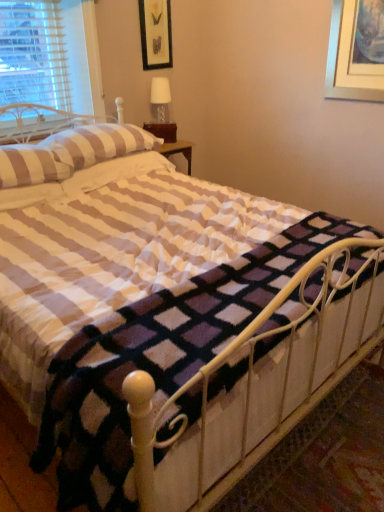
Question: Do you think striped fabric pillow at upper left, the 3th pillow in the back-to-front sequence, is within black matte picture frame at upper center, or outside of it?

Choices:
 (A) inside
 (B) outside

Answer: (B)

Question: In terms of height, does striped fabric pillow at upper left, the 3th pillow in the back-to-front sequence, look taller or shorter compared to black matte picture frame at upper center?

Choices:
 (A) short
 (B) tall

Answer: (A)

Question: Based on their relative distances, which object is nearer to the black matte picture frame at upper center?

Choices:
 (A) striped fabric pillow at upper left, marked as the 2th pillow in a front-to-back arrangement
 (B) white matte table lamp at upper center
 (C) striped fabric pillow at upper left, the 3th pillow in the back-to-front sequence
 (D) striped fabric pillow at upper left, which appears as the first pillow when viewed from the back
 (E) white metal bed frame at center

Answer: (B)

Question: Considering the real-world distances, which object is farthest from the striped fabric pillow at upper left, marked as the 2th pillow in a front-to-back arrangement?

Choices:
 (A) striped fabric pillow at upper left, which is the 1th pillow in front-to-back order
 (B) white metal bed frame at center
 (C) striped fabric pillow at upper left, which appears as the first pillow when viewed from the back
 (D) black matte picture frame at upper center
 (E) white matte table lamp at upper center

Answer: (B)